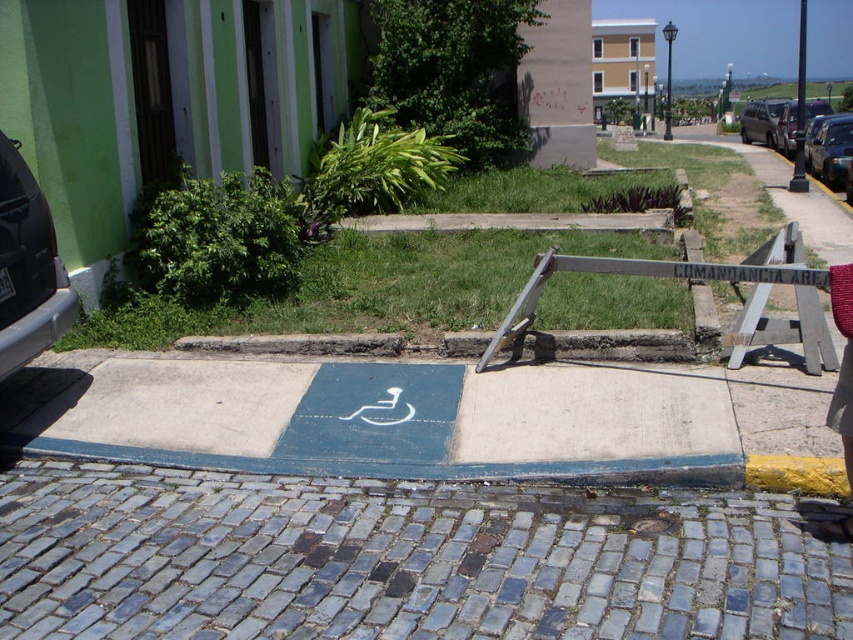
Is metallic gray car at left smaller than shiny black car at right?

Indeed, metallic gray car at left has a smaller size compared to shiny black car at right.

In the scene shown: Between metallic gray car at left and shiny black car at right, which one has less height?

metallic gray car at left

Image resolution: width=853 pixels, height=640 pixels. What do you see at coordinates (28, 268) in the screenshot?
I see `metallic gray car at left` at bounding box center [28, 268].

Where is `metallic gray car at left`? The height and width of the screenshot is (640, 853). metallic gray car at left is located at coordinates (28, 268).

Is blue cobblestone pavement at lower center taller than shiny black car at right?

No, blue cobblestone pavement at lower center is not taller than shiny black car at right.

Who is lower down, blue cobblestone pavement at lower center or shiny black car at right?

blue cobblestone pavement at lower center is lower down.

Is point (178, 586) less distant than point (843, 131)?

Yes, it is in front of point (843, 131).

The height and width of the screenshot is (640, 853). What are the coordinates of `blue cobblestone pavement at lower center` in the screenshot? It's located at (401, 561).

In the scene shown: Does wooden sign at center have a greater width compared to metallic silver car at right?

In fact, wooden sign at center might be narrower than metallic silver car at right.

Can you confirm if wooden sign at center is shorter than metallic silver car at right?

Yes, wooden sign at center is shorter than metallic silver car at right.

Is point (683, 260) less distant than point (786, 125)?

Yes, point (683, 260) is in front of point (786, 125).

At what (x,y) coordinates should I click in order to perform the action: click on wooden sign at center. Please return your answer as a coordinate pair (x, y). Looking at the image, I should click on (639, 275).